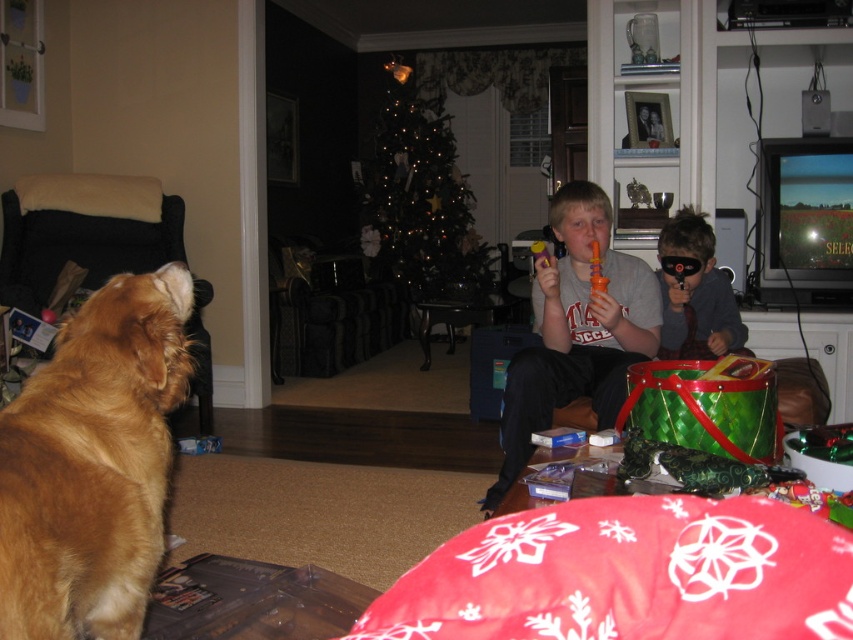
Question: Among these objects, which one is nearest to the camera?

Choices:
 (A) matte plastic toy at center
 (B) matte black mask at center

Answer: (A)

Question: Does golden fur dog at left lie in front of matte black mask at center?

Choices:
 (A) no
 (B) yes

Answer: (B)

Question: Based on their relative distances, which object is farther from the golden fur dog at left?

Choices:
 (A) matte plastic toy at center
 (B) illuminated glass christmas tree at center

Answer: (B)

Question: Does golden fur dog at left come in front of illuminated glass christmas tree at center?

Choices:
 (A) no
 (B) yes

Answer: (B)

Question: Which is nearer to the golden fur dog at left?

Choices:
 (A) matte plastic toy at center
 (B) illuminated glass christmas tree at center

Answer: (A)

Question: Is golden fur dog at left to the left of matte plastic toy at center from the viewer's perspective?

Choices:
 (A) no
 (B) yes

Answer: (B)